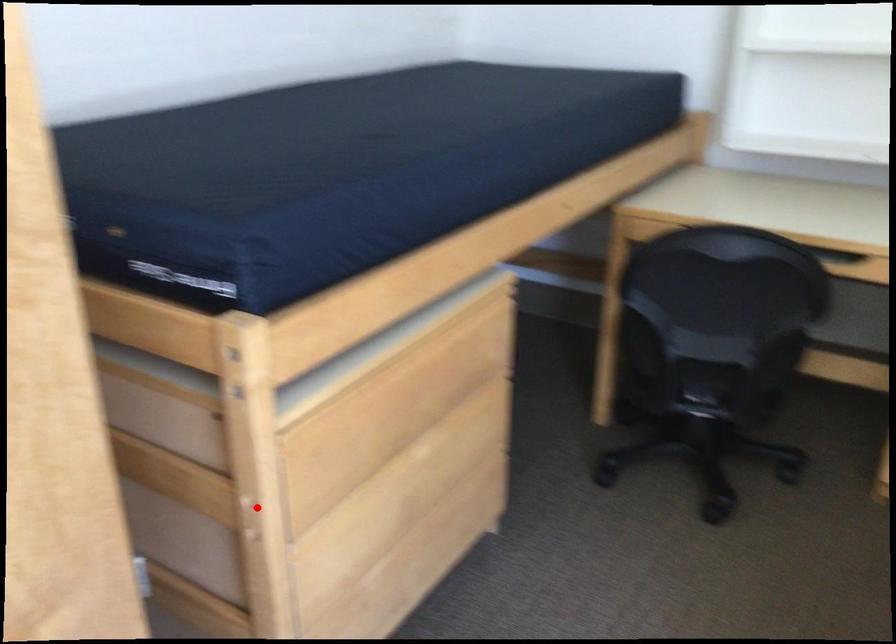
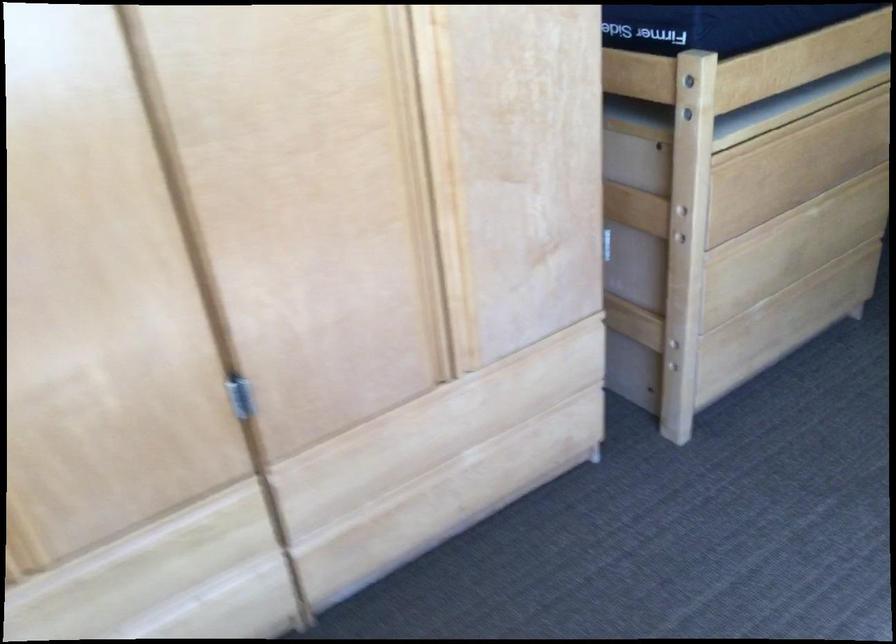
Question: A red point is marked in image1. In image2, is the corresponding 3D point closer to the camera or farther? Reply with the corresponding letter.

Choices:
 (A) The corresponding 3D point is closer.
 (B) The corresponding 3D point is farther.

Answer: (B)